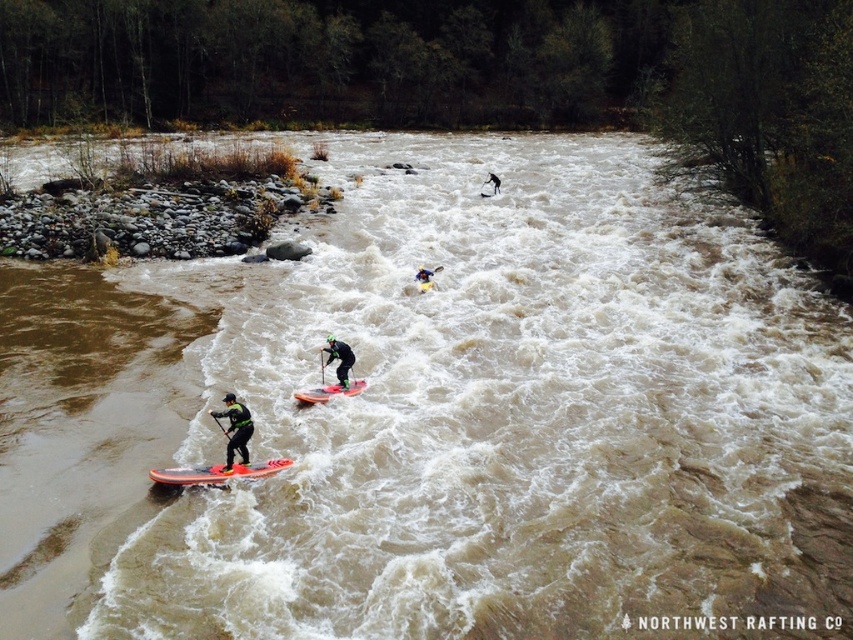
Question: Does black matte wetsuit at center have a lesser width compared to orange glossy paddleboard at center?

Choices:
 (A) yes
 (B) no

Answer: (B)

Question: Is orange matte surfboard at center positioned at the back of black matte wetsuit at center?

Choices:
 (A) yes
 (B) no

Answer: (B)

Question: Among these objects, which one is farthest from the camera?

Choices:
 (A) orange glossy paddleboard at center
 (B) black rubber kayak at upper center
 (C) black matte paddleboard at lower left
 (D) orange glossy surfboard at lower left

Answer: (B)

Question: Which object is positioned farthest from the orange glossy surfboard at lower left?

Choices:
 (A) orange matte surfboard at center
 (B) green neoprene jacket at center
 (C) black matte paddleboard at lower left

Answer: (B)

Question: Which object is farther from the camera taking this photo?

Choices:
 (A) black matte wetsuit at center
 (B) green neoprene jacket at center
 (C) black matte paddleboard at lower left
 (D) orange glossy surfboard at lower left

Answer: (B)

Question: Is orange matte surfboard at center wider than orange glossy paddleboard at center?

Choices:
 (A) no
 (B) yes

Answer: (B)